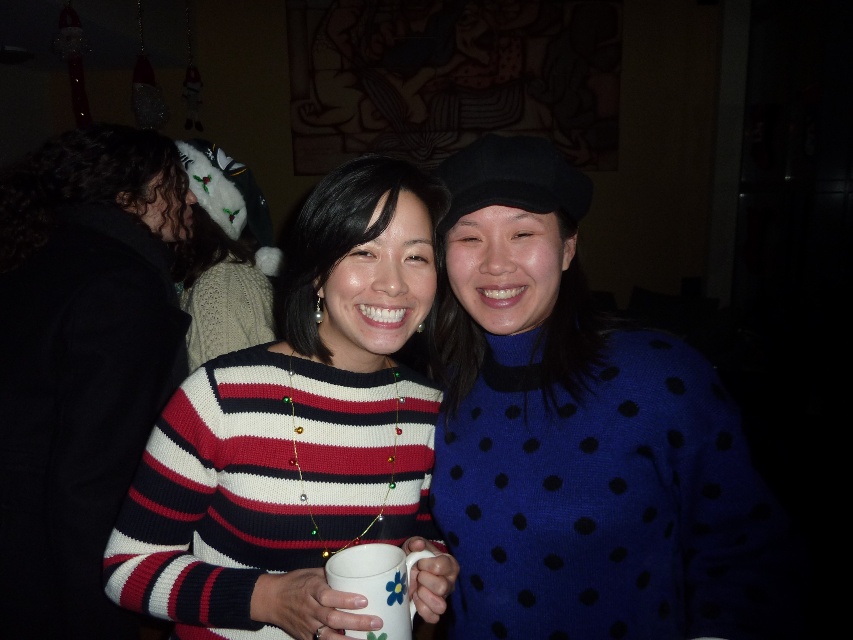
Question: Is knitted striped sweater at center to the right of white glossy mug at center from the viewer's perspective?

Choices:
 (A) no
 (B) yes

Answer: (A)

Question: Which point is farther to the camera?

Choices:
 (A) white glossy mug at center
 (B) knitted striped sweater at center
 (C) white knitted sweater at upper left
 (D) blue dotted sweater at center

Answer: (C)

Question: Is the position of blue dotted sweater at center less distant than that of striped knit sweater at center?

Choices:
 (A) no
 (B) yes

Answer: (B)

Question: Which point is closer to the camera?

Choices:
 (A) white knitted sweater at upper left
 (B) knitted striped sweater at center

Answer: (B)

Question: Which of the following is the closest to the observer?

Choices:
 (A) (122, 348)
 (B) (398, 628)

Answer: (B)

Question: Is blue dotted sweater at center below knitted striped sweater at center?

Choices:
 (A) no
 (B) yes

Answer: (A)